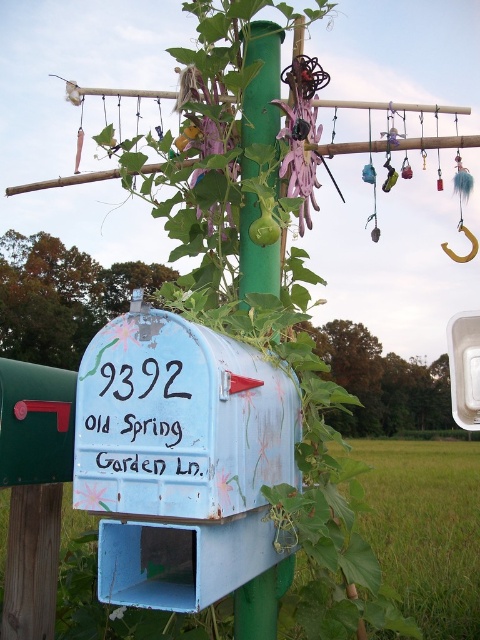
Question: Estimate the real-world distances between objects in this image. Which object is farther from the purple fabric flower at center?

Choices:
 (A) green matte pole at center
 (B) pink paper flower at lower left

Answer: (B)

Question: Which object is the closest to the white matte flower at center?

Choices:
 (A) purple fabric flower at center
 (B) pink paper flower at lower left

Answer: (B)

Question: Which point appears closest to the camera in this image?

Choices:
 (A) (303, 161)
 (B) (139, 342)
 (C) (276, 52)
 (D) (108, 488)

Answer: (D)

Question: Can you confirm if pink paper flower at lower left is bigger than white matte flower at center?

Choices:
 (A) yes
 (B) no

Answer: (B)

Question: Is pink paper flower at lower left smaller than white matte flower at center?

Choices:
 (A) yes
 (B) no

Answer: (A)

Question: Can you confirm if green matte pole at center is positioned to the right of purple fabric flower at center?

Choices:
 (A) no
 (B) yes

Answer: (A)